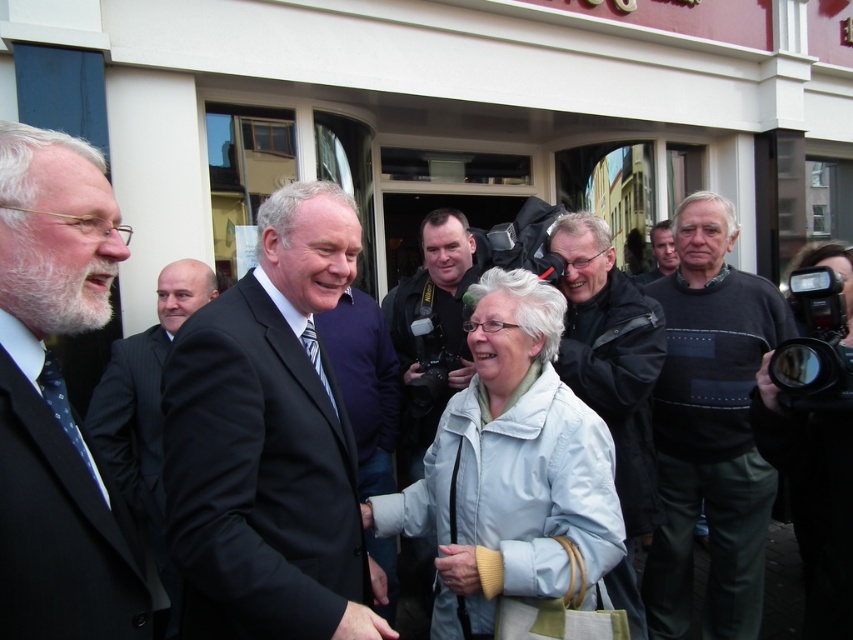
You are a photographer standing 3 meters away from the dark gray sweater at right and black pinstripe suit at left. Can you fit both subjects into a single frame without moving? The camera has a field of view that can capture a width of 2.5 meters.

The dark gray sweater at right and black pinstripe suit at left are 2.33 meters apart from each other. Since the camera can capture a width of 2.5 meters, you can fit both subjects into a single frame without moving.

Based on the photo, you are standing at the origin point in the image. Please determine the 2D coordinates of the dark gray sweater at right in the image coordinate system. The coordinate system has its origin at the bottom left corner of the image, with the x and y axes pointing to the right and up respectively.

The dark gray sweater at right is located at coordinates approximately 0.669 on the x axis and 0.834 on the y axis in the image coordinate system.